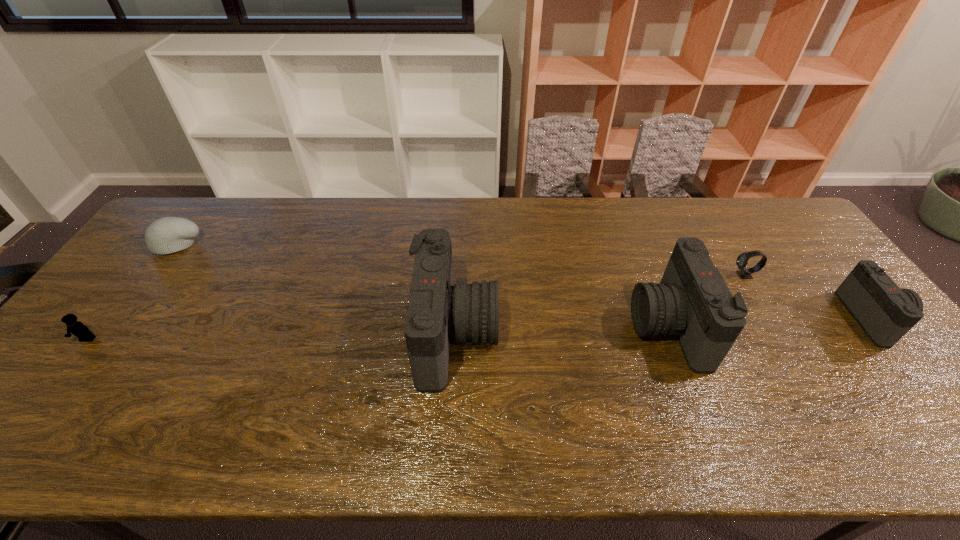
The height and width of the screenshot is (540, 960). In order to click on beanie positioned at the left edge in this screenshot , I will do `click(166, 235)`.

At what (x,y) coordinates should I click in order to perform the action: click on Lego present at the left edge. Please return your answer as a coordinate pair (x, y). Image resolution: width=960 pixels, height=540 pixels. Looking at the image, I should click on (77, 328).

At what (x,y) coordinates should I click in order to perform the action: click on object at the right edge. Please return your answer as a coordinate pair (x, y). Looking at the image, I should click on (885, 312).

The width and height of the screenshot is (960, 540). In order to click on object that is at the far left corner in this screenshot , I will do `click(166, 235)`.

This screenshot has height=540, width=960. Find the location of `vacant space at the far edge of the desktop`. vacant space at the far edge of the desktop is located at coordinates (286, 214).

The height and width of the screenshot is (540, 960). In the image, there is a desktop. In order to click on vacant space at the near edge in this screenshot , I will do click(350, 379).

Where is `vacant area at the left edge of the desktop`? vacant area at the left edge of the desktop is located at coordinates (115, 308).

Locate an element on the screen. The height and width of the screenshot is (540, 960). vacant region at the right edge of the desktop is located at coordinates (850, 338).

What are the coordinates of `free location at the far left corner of the desktop` in the screenshot? It's located at (204, 238).

The image size is (960, 540). Identify the location of free space at the far right corner. (735, 197).